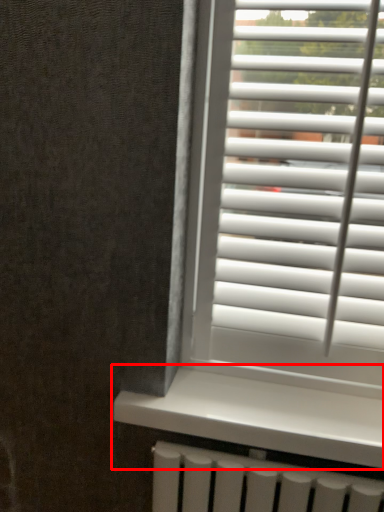
Question: Where is window sill (annotated by the red box) located in relation to blind in the image?

Choices:
 (A) right
 (B) left

Answer: (B)